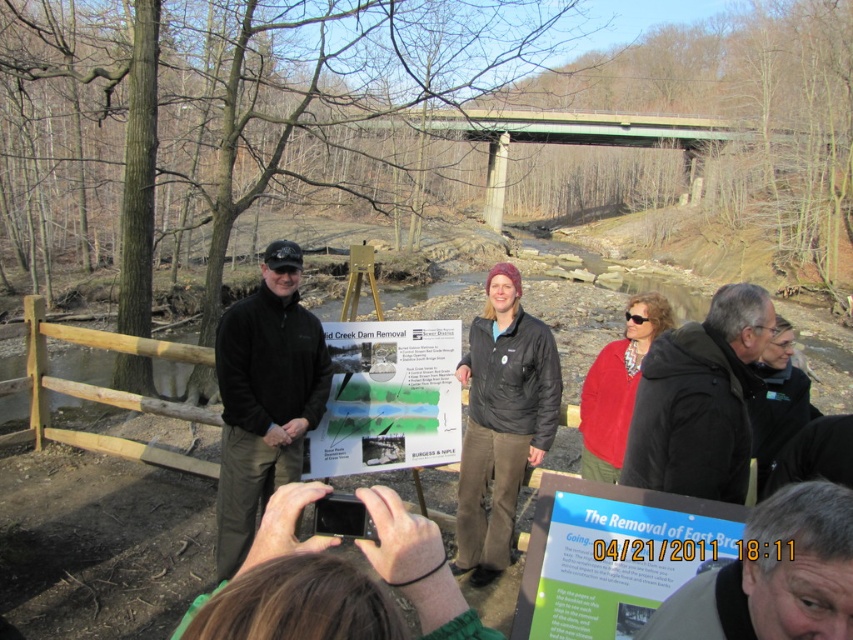
Can you confirm if gray fabric jacket at center is bigger than matte paper poster at center?

No, gray fabric jacket at center is not bigger than matte paper poster at center.

Describe the element at coordinates (773, 576) in the screenshot. The width and height of the screenshot is (853, 640). I see `gray fabric jacket at center` at that location.

Where is `gray fabric jacket at center`? This screenshot has width=853, height=640. gray fabric jacket at center is located at coordinates point(773,576).

The height and width of the screenshot is (640, 853). I want to click on black fleece jacket at center, so click(264, 397).

Which is behind, point (218, 554) or point (538, 109)?

The point (538, 109) is behind.

Where is `black fleece jacket at center`? The image size is (853, 640). black fleece jacket at center is located at coordinates (264, 397).

Which of these two, blue glossy poster at center or red matte jacket at center, stands shorter?

blue glossy poster at center is shorter.

From the picture: Is blue glossy poster at center in front of red matte jacket at center?

Yes, it is in front of red matte jacket at center.

Does point (592, 536) lie behind point (645, 308)?

That is False.

Identify the location of blue glossy poster at center. (614, 557).